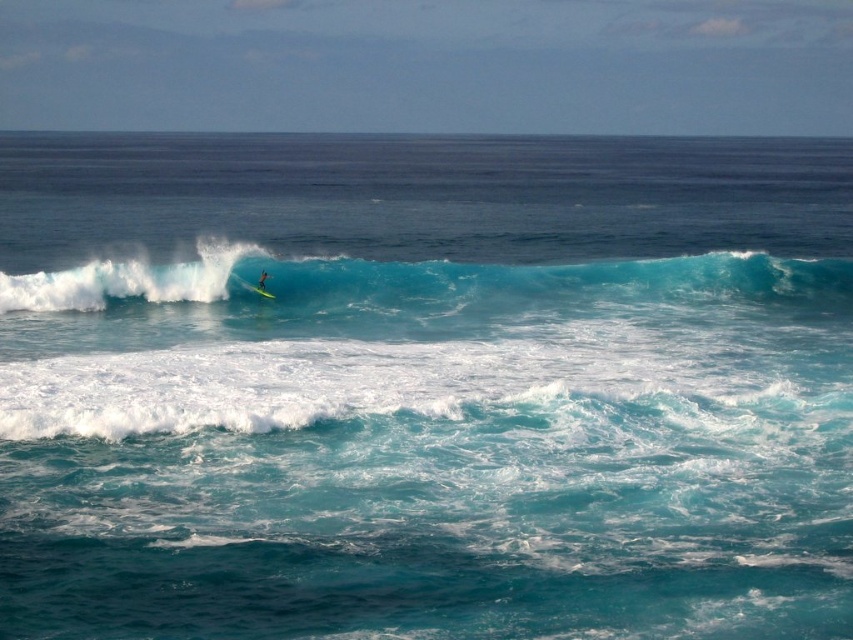
Which of these two, translucent blue wave at center or yellow-green smooth surfboard at center, stands shorter?

With less height is yellow-green smooth surfboard at center.

Where is `translucent blue wave at center`? Image resolution: width=853 pixels, height=640 pixels. translucent blue wave at center is located at coordinates (422, 280).

The image size is (853, 640). Identify the location of translucent blue wave at center. (422, 280).

Who is positioned more to the right, translucent blue wave at center or yellow surfboard at center?

translucent blue wave at center

Is translucent blue wave at center taller than yellow surfboard at center?

Indeed, translucent blue wave at center has a greater height compared to yellow surfboard at center.

Measure the distance between point (749, 273) and camera.

33.74 meters

Find the location of a particular element. The image size is (853, 640). translucent blue wave at center is located at coordinates (422, 280).

Does yellow-green smooth surfboard at center have a lesser width compared to yellow surfboard at center?

In fact, yellow-green smooth surfboard at center might be wider than yellow surfboard at center.

Does yellow-green smooth surfboard at center have a greater width compared to yellow surfboard at center?

Indeed, yellow-green smooth surfboard at center has a greater width compared to yellow surfboard at center.

Who is more forward, (248, 291) or (260, 276)?

Point (260, 276) is more forward.

The height and width of the screenshot is (640, 853). I want to click on yellow-green smooth surfboard at center, so click(251, 285).